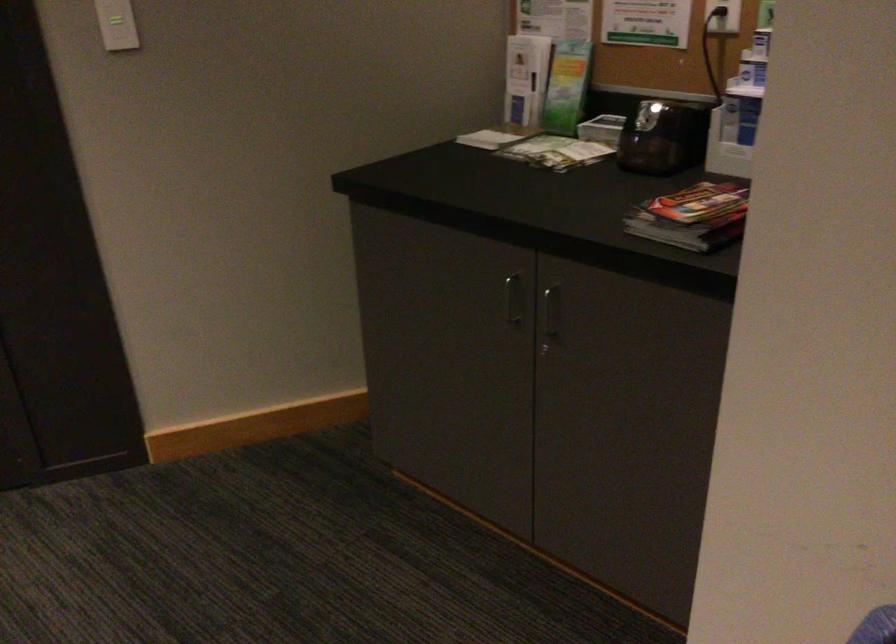
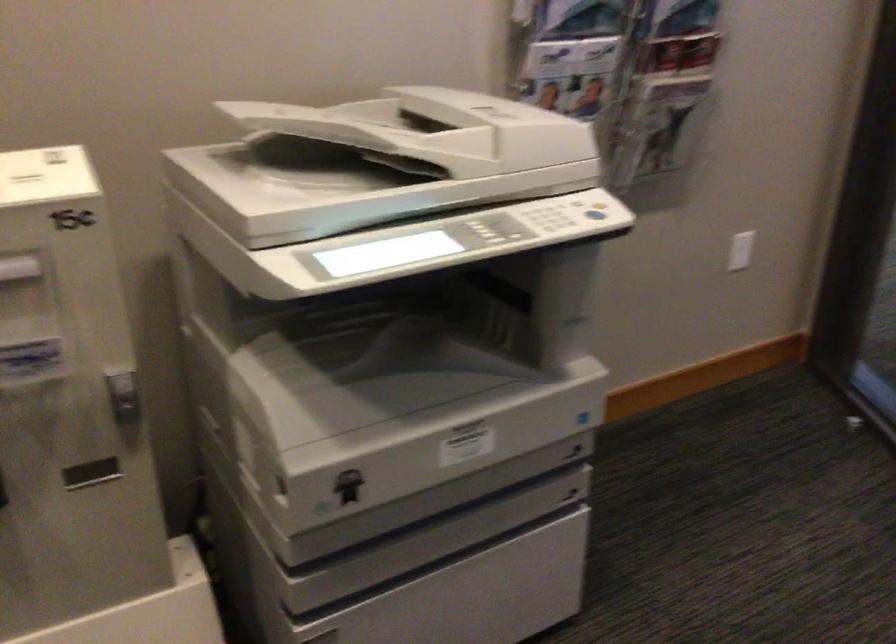
The first image is from the beginning of the video and the second image is from the end. How did the camera likely rotate when shooting the video?

The camera's rotation is toward left-down.